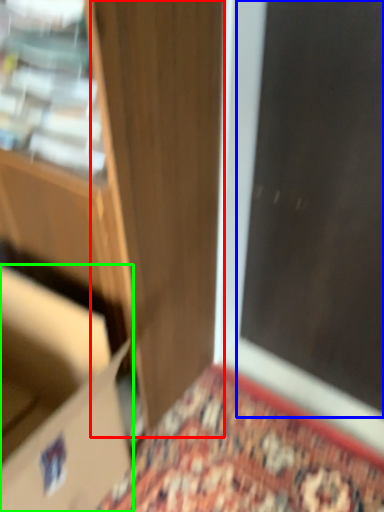
Question: Which is nearer to the door (highlighted by a red box)? screen door (highlighted by a blue box) or cardboard box (highlighted by a green box).

Choices:
 (A) screen door
 (B) cardboard box

Answer: (B)